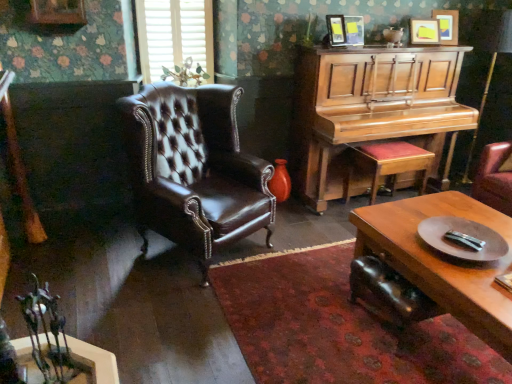
Image resolution: width=512 pixels, height=384 pixels. Identify the location of free space in front of brown leather chair at left. (198, 319).